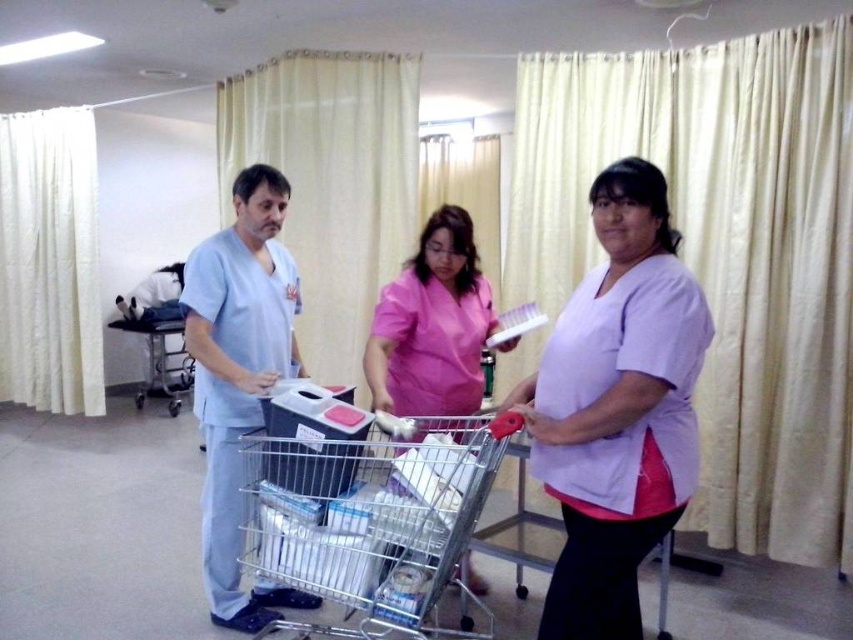
Question: Can you confirm if light blue scrubs at center is bigger than pink fabric shirt at center?

Choices:
 (A) yes
 (B) no

Answer: (A)

Question: Is metallic silver trolley at center above pink fabric shirt at center?

Choices:
 (A) no
 (B) yes

Answer: (A)

Question: Among these objects, which one is nearest to the camera?

Choices:
 (A) pink fabric shirt at center
 (B) purple fabric shirt at center

Answer: (B)

Question: Which point is closer to the camera?

Choices:
 (A) metallic silver trolley at center
 (B) metallic silver trolley at left
 (C) pink fabric shirt at center
 (D) purple fabric shirt at center

Answer: (D)

Question: Which object is farther from the camera taking this photo?

Choices:
 (A) purple fabric shirt at center
 (B) metallic silver trolley at left

Answer: (B)

Question: Where is purple fabric shirt at center located in relation to light blue scrubs at center in the image?

Choices:
 (A) right
 (B) left

Answer: (A)